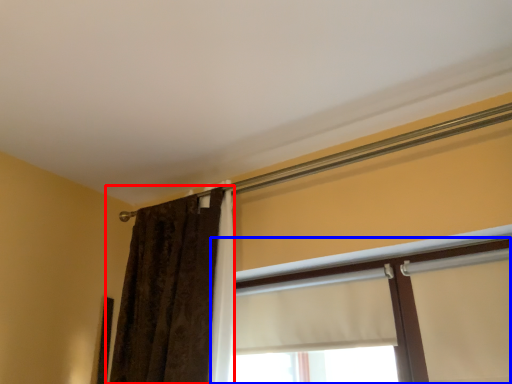
Question: Which of the following is the farthest to the observer, curtain (highlighted by a red box) or window (highlighted by a blue box)?

Choices:
 (A) curtain
 (B) window

Answer: (A)